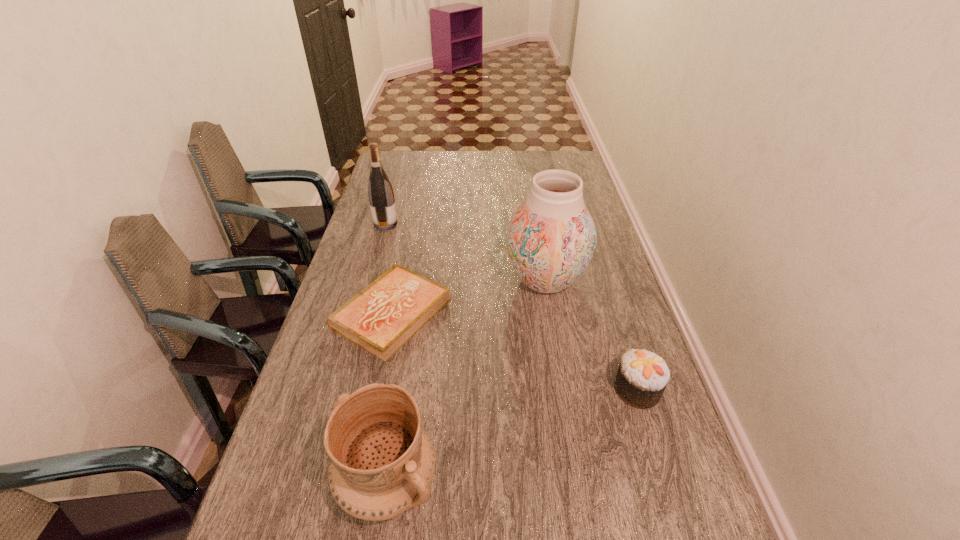
Where is `vase`? This screenshot has height=540, width=960. vase is located at coordinates (551, 238).

I want to click on wine bottle, so click(380, 192).

You are a GUI agent. You are given a task and a screenshot of the screen. Output one action in this format:
    pyautogui.click(x=<x>, y=<y>)
    Task: Click on the pottery
    This screenshot has height=540, width=960.
    Given the screenshot: What is the action you would take?
    pyautogui.click(x=382, y=462)

Where is `the nearest object`? The height and width of the screenshot is (540, 960). the nearest object is located at coordinates (382, 462).

Locate an element on the screen. This screenshot has width=960, height=540. cupcake is located at coordinates (642, 376).

At what (x,y) coordinates should I click in order to perform the action: click on the second nearest object. Please return your answer as a coordinate pair (x, y). The image size is (960, 540). Looking at the image, I should click on (642, 376).

I want to click on the shortest object, so click(381, 318).

Find the location of a particular element. vacant space located on the front of the vase is located at coordinates (554, 333).

Find the location of a particular element. The height and width of the screenshot is (540, 960). free space located 0.080m on the label of the farthest object is located at coordinates (420, 224).

I want to click on free space located on the right of the pottery, so click(567, 481).